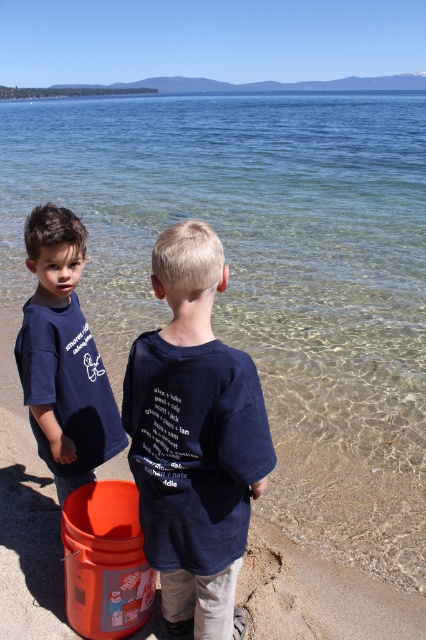
Which of these two, navy blue t-shirt at center or matte dark blue t-shirt at left, stands shorter?

matte dark blue t-shirt at left

Does navy blue t-shirt at center appear on the left side of matte dark blue t-shirt at left?

In fact, navy blue t-shirt at center is to the right of matte dark blue t-shirt at left.

Is point (210, 442) in front of point (74, 419)?

Yes, it is in front of point (74, 419).

Identify the location of navy blue t-shirt at center. (193, 436).